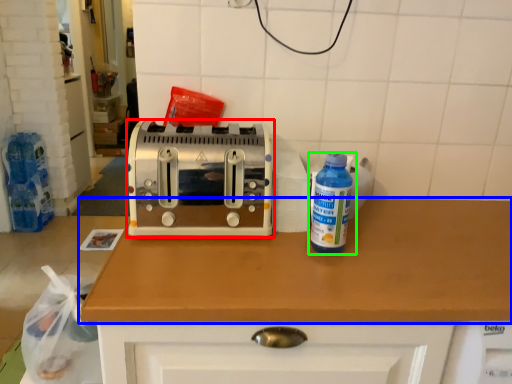
Question: Which object is positioned farthest from toaster (highlighted by a red box)? Select from countertop (highlighted by a blue box) and bottle (highlighted by a green box).

Choices:
 (A) countertop
 (B) bottle

Answer: (B)